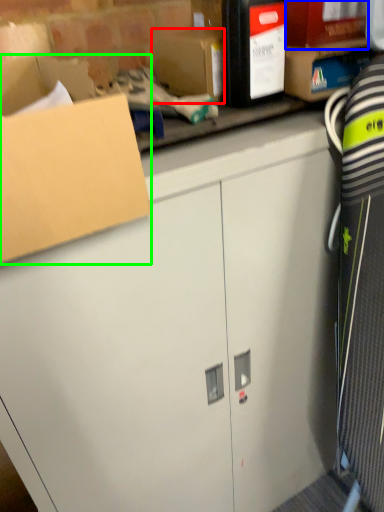
Question: Estimate the real-world distances between objects in this image. Which object is closer to storage box (highlighted by a red box), storage box (highlighted by a blue box) or box (highlighted by a green box)?

Choices:
 (A) storage box
 (B) box

Answer: (A)